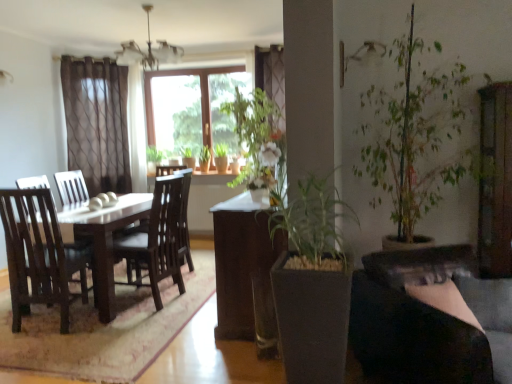
Question: Based on their positions, is green leafy plant at center, which appears as the first houseplant when viewed from the top, located to the left or right of green matte plant at center, which is the first houseplant in front-to-back order?

Choices:
 (A) right
 (B) left

Answer: (B)

Question: In terms of height, does green leafy plant at center, placed as the 1th houseplant when sorted from left to right, look taller or shorter compared to green matte plant at center, positioned as the second houseplant in left-to-right order?

Choices:
 (A) short
 (B) tall

Answer: (A)

Question: Estimate the real-world distances between objects in this image. Which object is closer to the green leafy plant at center, acting as the 2th houseplant starting from the front?

Choices:
 (A) green matte plant at center, positioned as the second houseplant in left-to-right order
 (B) brown wooden table at center

Answer: (B)

Question: Based on their relative distances, which object is nearer to the brown wooden table at center?

Choices:
 (A) green matte plant at center, which is the first houseplant in front-to-back order
 (B) green leafy plant at center, arranged as the second houseplant when ordered from the bottom

Answer: (A)